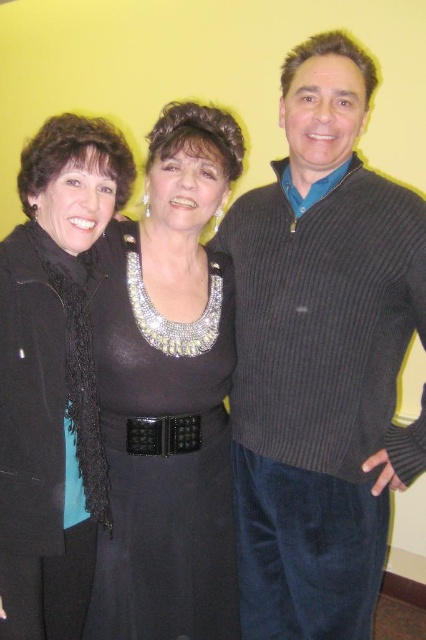
You are taking a photo of three people standing against a yellow wall. The scene includes a black matte scarf at left. Where is the black matte scarf positioned relative to the people?

The black matte scarf at left is located at point [52,376] relative to the people in the scene.

In the scene shown: You are trying to decide whether to wear the ribbed sweater at center and the black leather belt at center together. Based on their sizes, can you wear them together?

The ribbed sweater at center is bigger than the black leather belt at center, so yes, you can wear them together as the sweater is larger and can accommodate the belt.

You are a photographer trying to capture a group photo of the ribbed sweater at center and the black satin dress at center. Since you want to ensure both subjects are fully visible in the frame, which clothing item requires more space in the shot due to its width?

The ribbed sweater at center requires more space in the shot because its width is larger than the black satin dress at center.